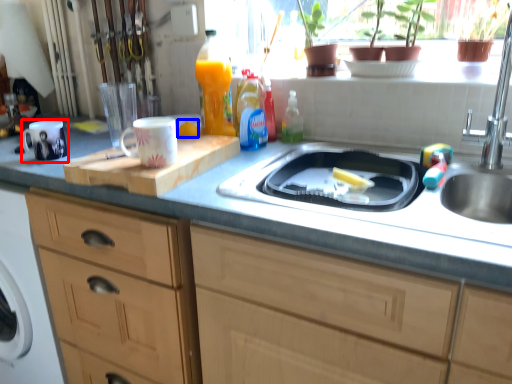
Question: Which of the following is the farthest to the observer, mug (highlighted by a red box) or food (highlighted by a blue box)?

Choices:
 (A) mug
 (B) food

Answer: (B)